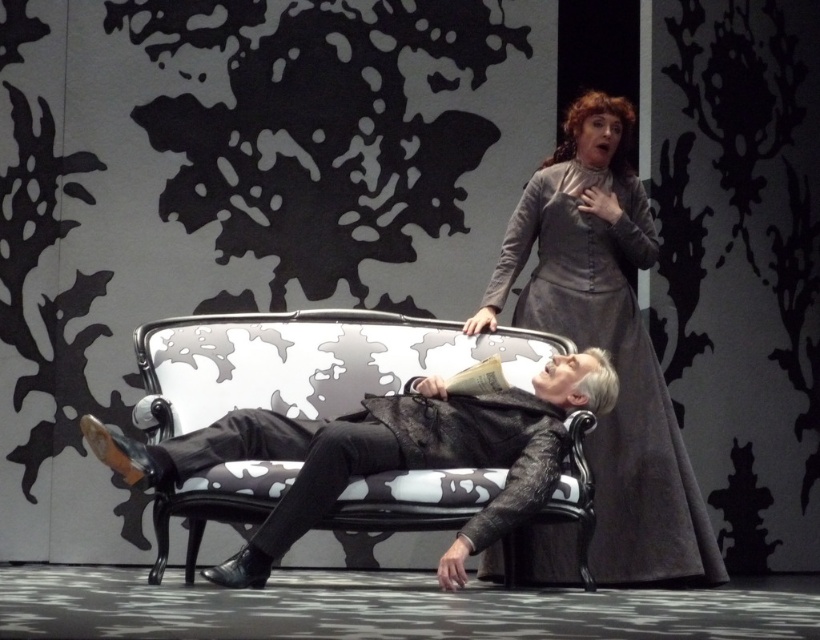
Who is shorter, gray wool dress at upper right or leather jacket at center?

Standing shorter between the two is leather jacket at center.

Is gray wool dress at upper right wider than leather jacket at center?

Incorrect, gray wool dress at upper right's width does not surpass leather jacket at center's.

Image resolution: width=820 pixels, height=640 pixels. What are the coordinates of `gray wool dress at upper right` in the screenshot? It's located at (616, 371).

Can you confirm if leather jacket at center is wider than black leather pants at center?

Yes, leather jacket at center is wider than black leather pants at center.

Does point (568, 371) lie behind point (285, 547)?

Yes, it is behind point (285, 547).

Locate an element on the screen. This screenshot has height=640, width=820. leather jacket at center is located at coordinates (385, 454).

Is gray wool dress at upper right wider than black leather pants at center?

Yes, gray wool dress at upper right is wider than black leather pants at center.

Is gray wool dress at upper right shorter than black leather pants at center?

Incorrect, gray wool dress at upper right's height does not fall short of black leather pants at center's.

Between point (594, 316) and point (263, 522), which one is positioned in front?

Point (263, 522) is more forward.

Where is `gray wool dress at upper right`? Image resolution: width=820 pixels, height=640 pixels. gray wool dress at upper right is located at coordinates (616, 371).